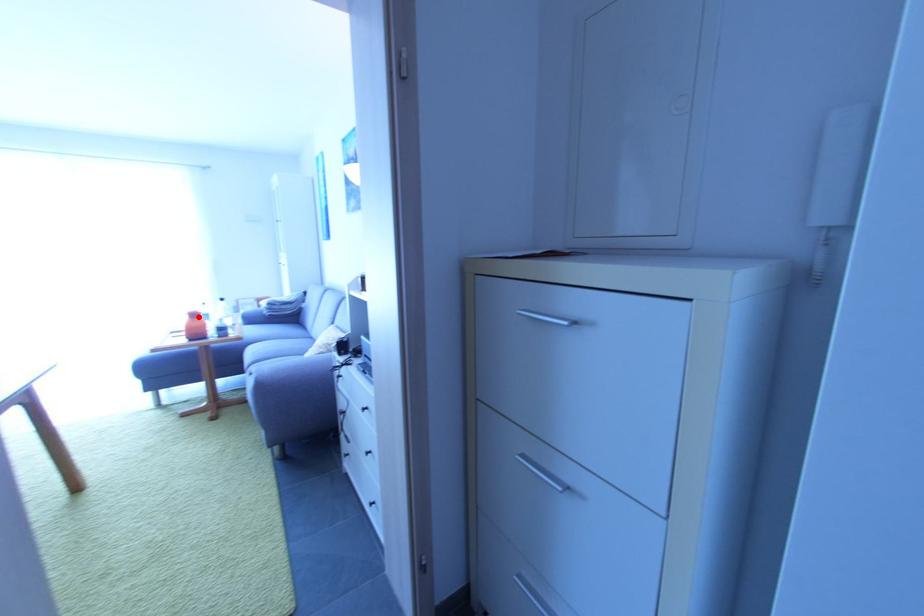
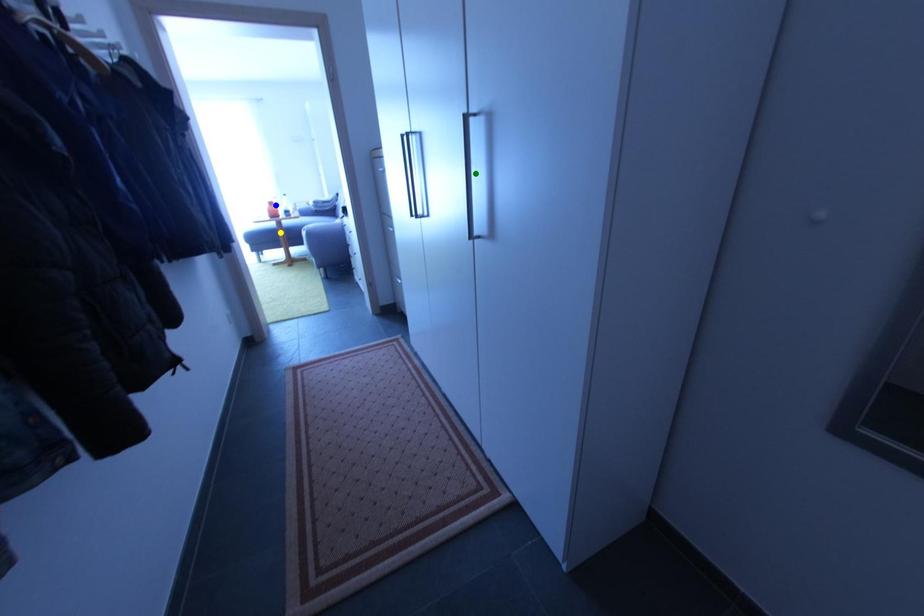
Question: I am providing you with two images of the same scene from different viewpoints. A red point is marked on the first image. You are given multiple points on the second image. In image 2, which mark is for the same physical point as the one in image 1?

Choices:
 (A) yellow point
 (B) green point
 (C) blue point

Answer: (C)